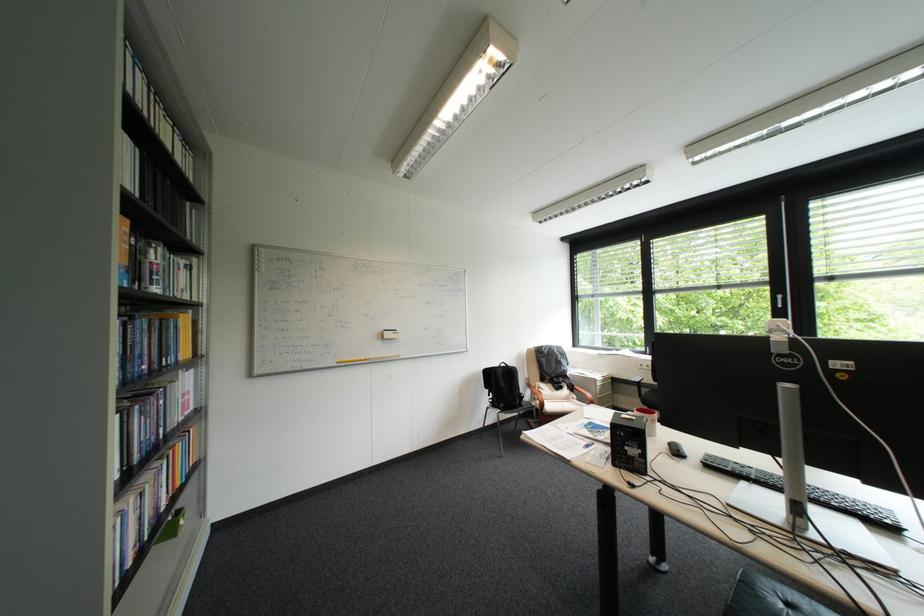
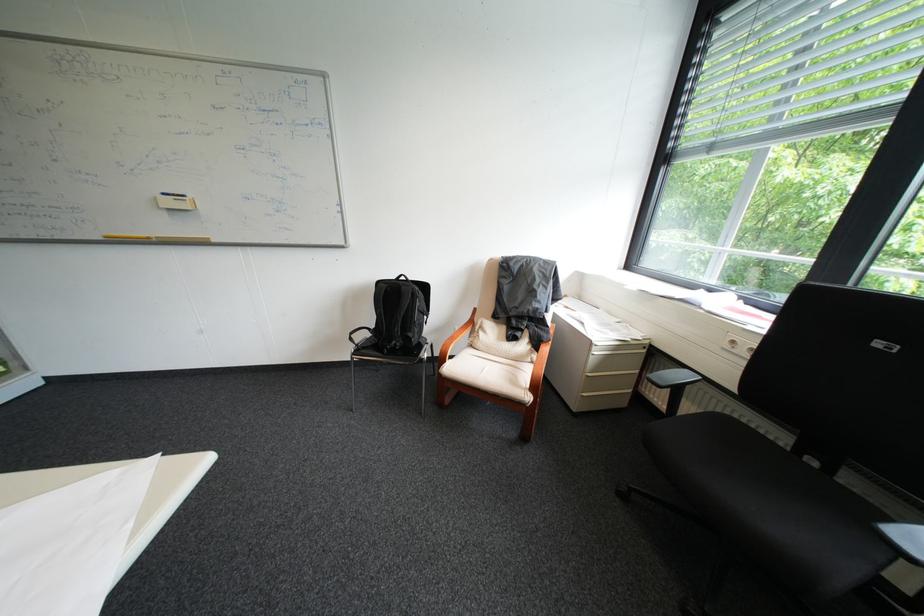
The point at (556, 406) is marked in the first image. Where is the corresponding point in the second image?

(456, 363)